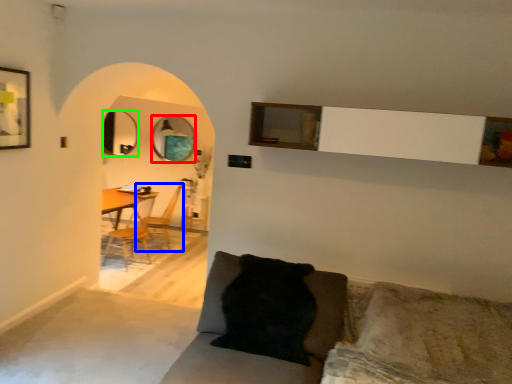
Question: Estimate the real-world distances between objects in this image. Which object is closer to mirror (highlighted by a red box), armchair (highlighted by a blue box) or mirror (highlighted by a green box)?

Choices:
 (A) armchair
 (B) mirror

Answer: (B)